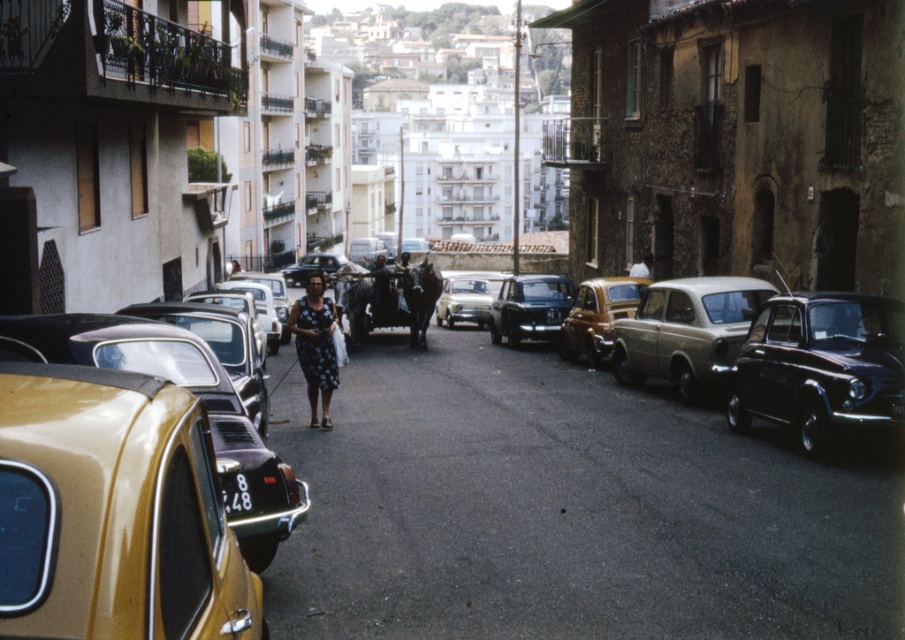
Does blue floral dress at center appear over shiny silver car at center?

Actually, blue floral dress at center is below shiny silver car at center.

Who is shorter, blue floral dress at center or shiny silver car at center?

Standing shorter between the two is blue floral dress at center.

Is point (324, 321) more distant than point (446, 284)?

No, it is in front of (446, 284).

At what (x,y) coordinates should I click in order to perform the action: click on blue floral dress at center. Please return your answer as a coordinate pair (x, y). The height and width of the screenshot is (640, 905). Looking at the image, I should click on (315, 344).

Is matte yellow taxi at center wider than blue floral dress at center?

Correct, the width of matte yellow taxi at center exceeds that of blue floral dress at center.

How far apart are matte yellow taxi at center and blue floral dress at center?

They are 22.62 feet apart.

Which is in front, point (645, 284) or point (318, 385)?

Point (318, 385) is more forward.

Image resolution: width=905 pixels, height=640 pixels. I want to click on matte yellow taxi at center, so click(x=597, y=316).

Can you confirm if shiny black car at right is positioned above matte black car at center?

Incorrect, shiny black car at right is not positioned above matte black car at center.

Can you confirm if shiny black car at right is positioned below matte black car at center?

Indeed, shiny black car at right is positioned under matte black car at center.

Who is more forward, (805,435) or (508,337)?

Point (805,435) is in front.

At what (x,y) coordinates should I click in order to perform the action: click on shiny black car at right. Please return your answer as a coordinate pair (x, y). The image size is (905, 640). Looking at the image, I should click on (818, 365).